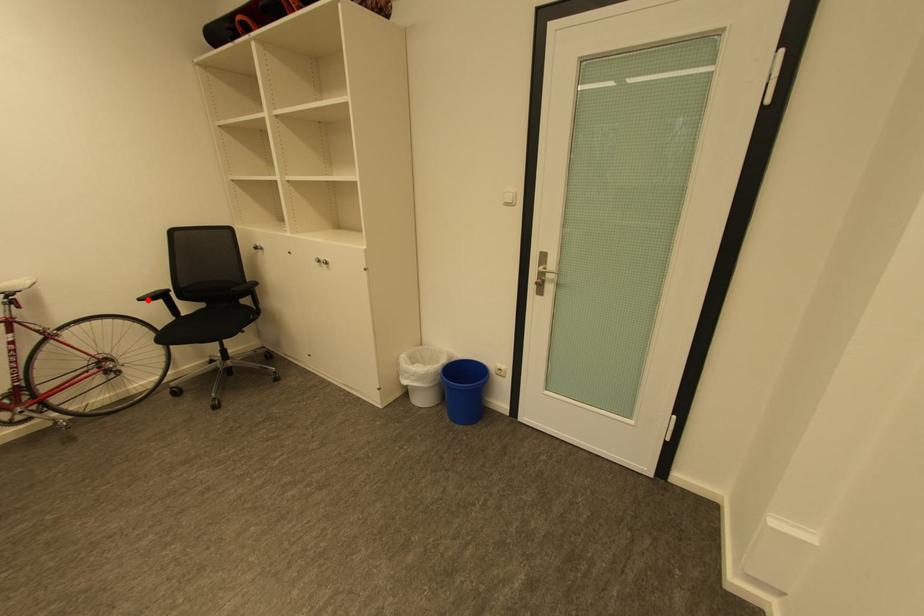
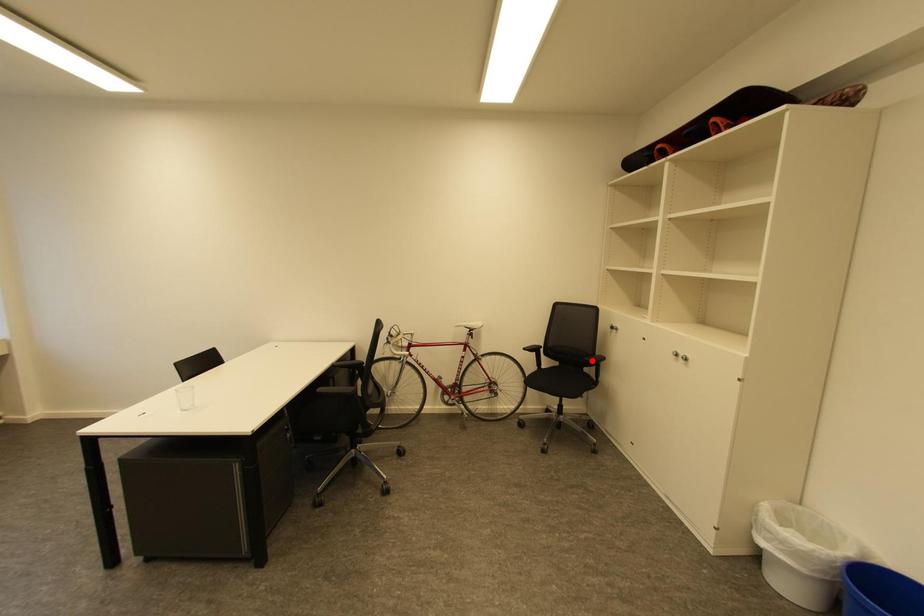
I am providing you with two images of the same scene from different viewpoints. A red point is marked on the first image and another point is marked on the second image. Does the point marked in image1 correspond to the same location as the one in image2?

No